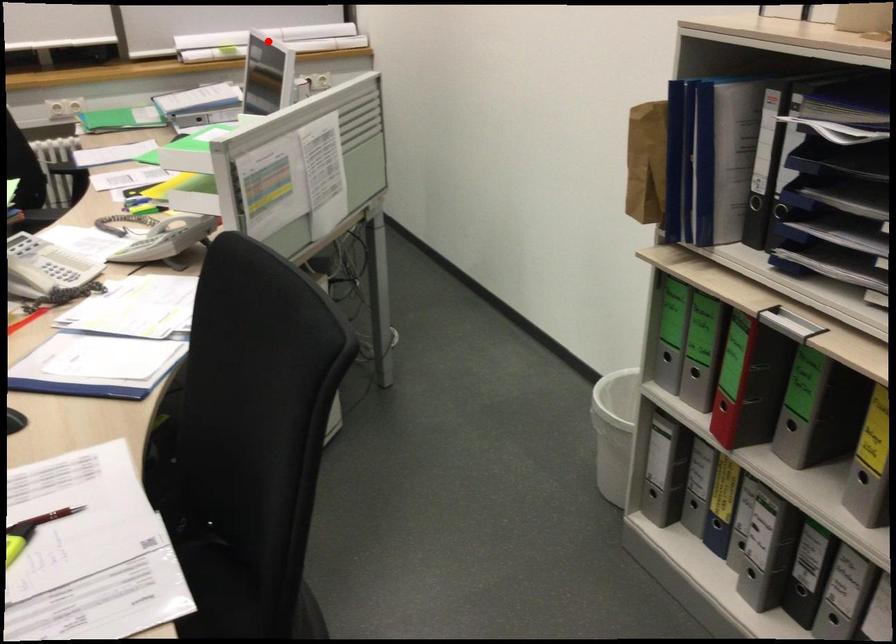
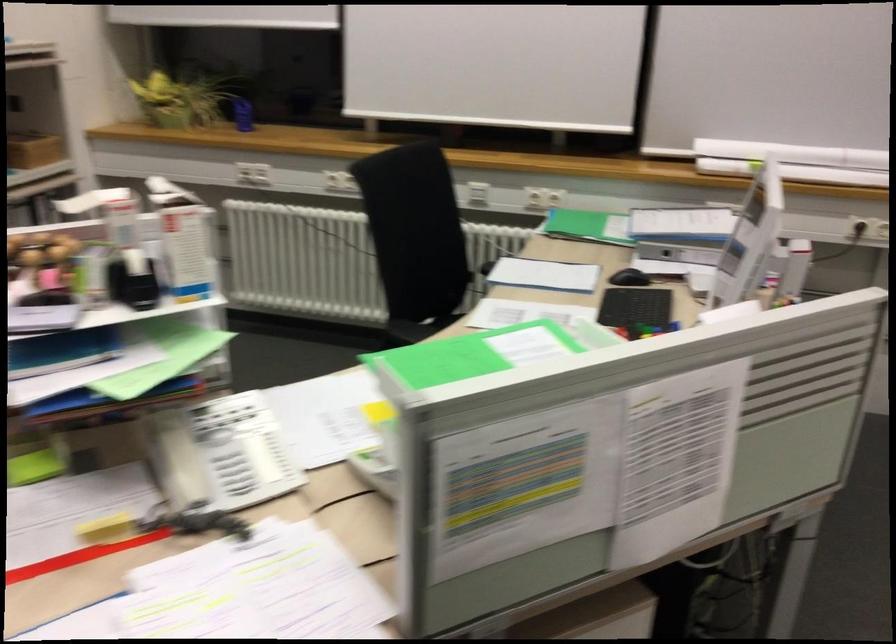
Question: I am providing you with two images of the same scene from different viewpoints. A red point is marked on the first image. Is the red point's position out of view in image 2?

Choices:
 (A) Yes
 (B) No

Answer: (A)